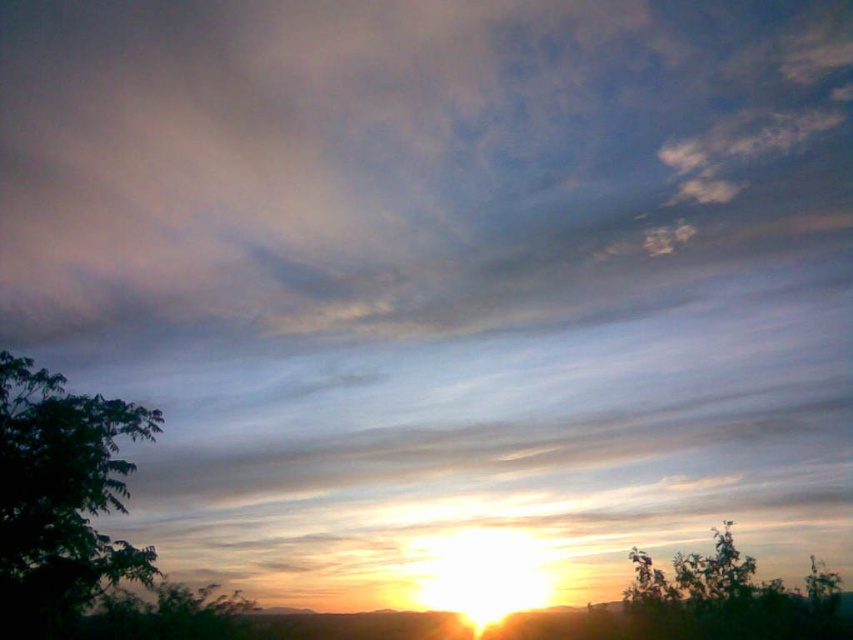
You are standing in the middle of the scene and want to take a photo of the green leafy tree at left. In which direction should you point your camera to capture it?

The green leafy tree at left is located at point (61, 497), which means it is positioned to the left and slightly above the center of the scene. To capture it, you should point your camera to the left and slightly upwards.

From the picture: You are a bird looking for a place to perch. You see two trees in the image, the green leafy tree at left and the green leafy tree at lower right. Which tree would you choose if you prefer a larger tree to rest on?

The green leafy tree at lower right is larger in size compared to the green leafy tree at left, so you should choose the green leafy tree at lower right to rest on.

You are planning to take a photo of the sunset with both the green leafy tree at left and the green leafy tree at lower right in the frame. Which tree should you position closer to the center to ensure both fit in the photo?

You should position the green leafy tree at left closer to the center because it has a smaller width compared to the green leafy tree at lower right, allowing both to fit within the frame more easily.